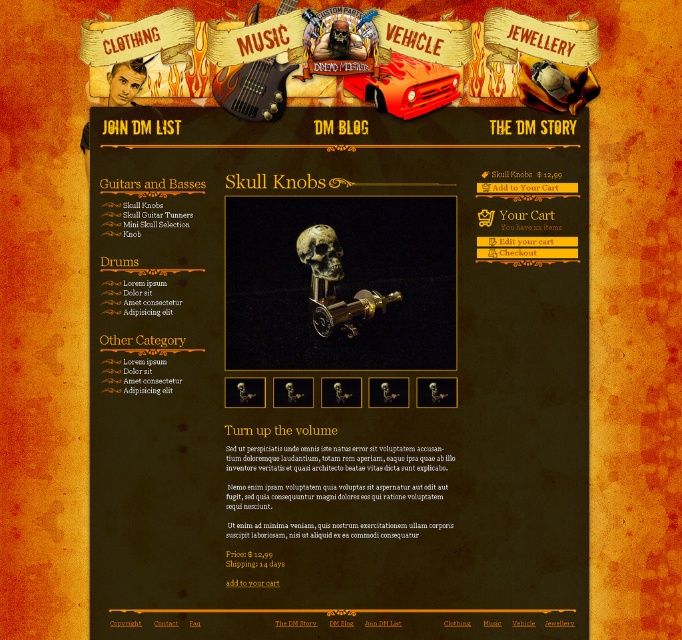
Is red matte vehicle at center shorter than gold metallic skull at center?

No, red matte vehicle at center is not shorter than gold metallic skull at center.

Is red matte vehicle at center to the left of gold metallic skull at center from the viewer's perspective?

In fact, red matte vehicle at center is to the right of gold metallic skull at center.

The image size is (682, 640). Identify the location of red matte vehicle at center. (404, 86).

At what (x,y) coordinates should I click in order to perform the action: click on red matte vehicle at center. Please return your answer as a coordinate pair (x, y). Looking at the image, I should click on (404, 86).